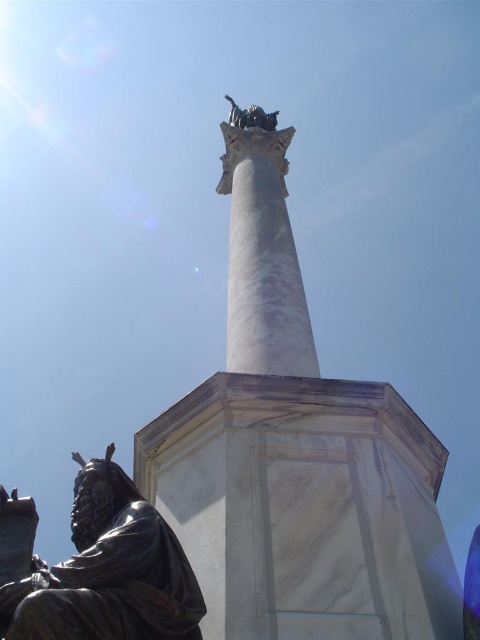
You are an art student analyzing the monument. You notice the bronze statue at lower left and the white marble column at center. Which object takes up more visual space in the composition?

The white marble column at center occupies more visual space than the bronze statue at lower left, as it is larger in size.

You are a photographer standing at the base of the monument. You want to take a photo that includes both the white marble column at center and the bronze statue at top. Which object should you focus on first to ensure both are in sharp focus?

The white marble column at center is closer to the viewer than the bronze statue at top, so you should focus on the white marble column at center first to ensure both are in sharp focus.

In the scene shown: You are a photographer standing at the camera position. You want to take a photo of the monument but need to ensure the bronze statue at lower left is not in the frame. What should you do?

The bronze statue at lower left is 16.65 meters from the camera. To avoid including it in the frame, you should move closer to the monument or adjust your angle so that the statue is out of the camera view.